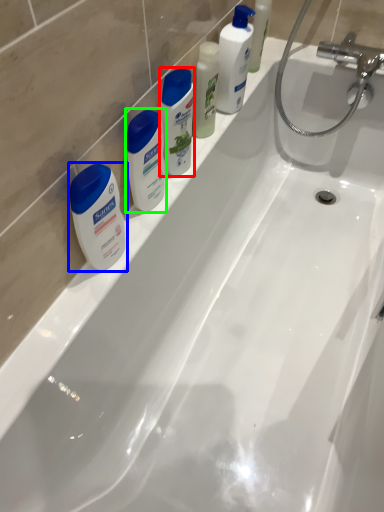
Question: Which object is positioned farthest from cleaning product (highlighted by a red box)? Select from toiletry (highlighted by a blue box) and toiletry (highlighted by a green box).

Choices:
 (A) toiletry
 (B) toiletry

Answer: (A)